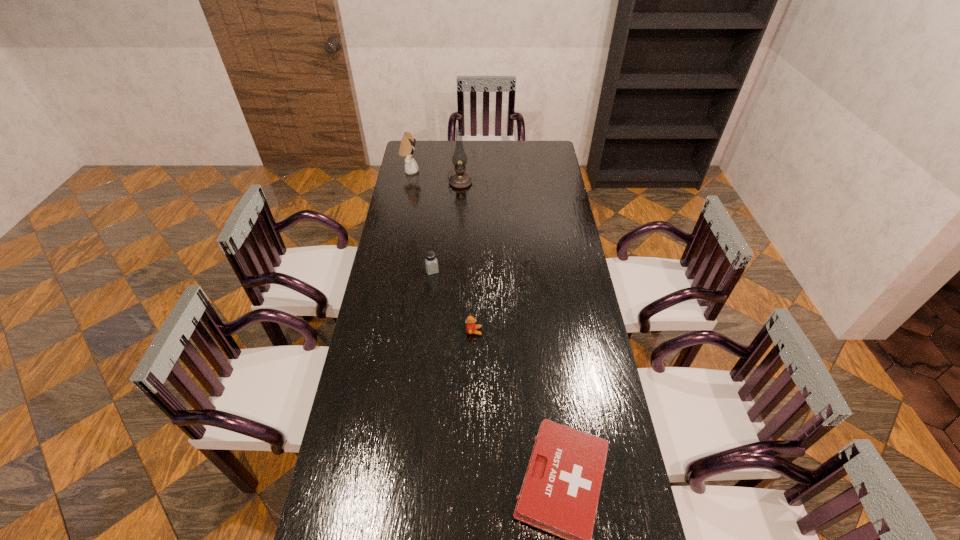
You are a GUI agent. You are given a task and a screenshot of the screen. Output one action in this format:
    pyautogui.click(x=<x>, y=<y>)
    Task: Click on the tallest object
    Image resolution: width=960 pixels, height=540 pixels.
    Given the screenshot: What is the action you would take?
    pyautogui.click(x=460, y=180)

This screenshot has width=960, height=540. In order to click on doll in this screenshot , I will do click(407, 145).

I want to click on the leftmost object, so click(407, 145).

Where is `the second object from left to right`? The width and height of the screenshot is (960, 540). the second object from left to right is located at coordinates (431, 263).

The height and width of the screenshot is (540, 960). In order to click on the third farthest object in this screenshot , I will do `click(431, 263)`.

You are a GUI agent. You are given a task and a screenshot of the screen. Output one action in this format:
    pyautogui.click(x=<x>, y=<y>)
    Task: Click on the second nearest object
    Image resolution: width=960 pixels, height=540 pixels.
    Given the screenshot: What is the action you would take?
    pyautogui.click(x=471, y=328)

In order to click on vacant point located 0.280m on the back of the tallest object in this screenshot , I will do `click(462, 148)`.

This screenshot has height=540, width=960. What are the coordinates of `vacant point located at the front face of the fourth shortest object` in the screenshot? It's located at (442, 171).

The height and width of the screenshot is (540, 960). I want to click on vacant area located 0.240m on the back of the saltshaker, so click(x=437, y=228).

Locate an element on the screen. The width and height of the screenshot is (960, 540). vacant space located 0.090m on the front-facing side of the teddy bear is located at coordinates (507, 331).